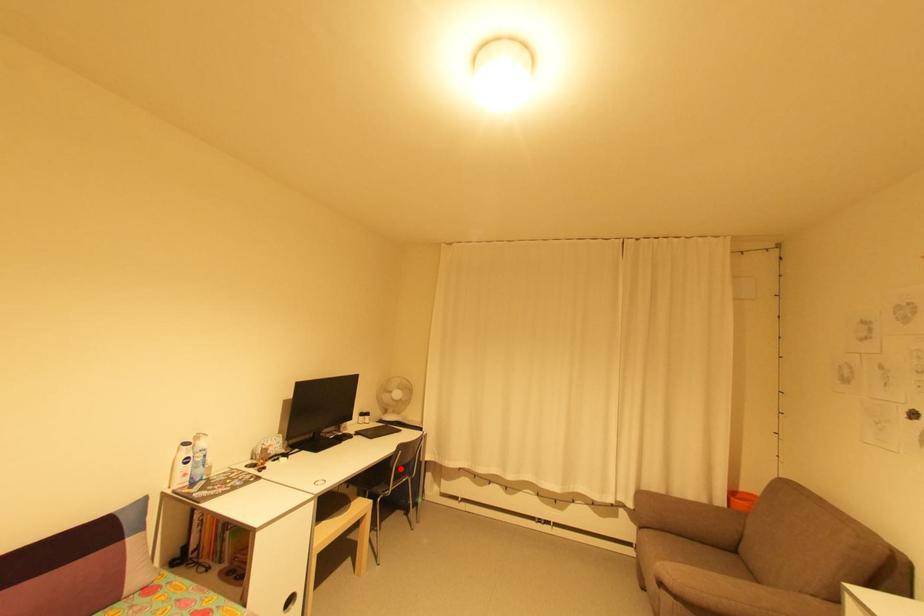
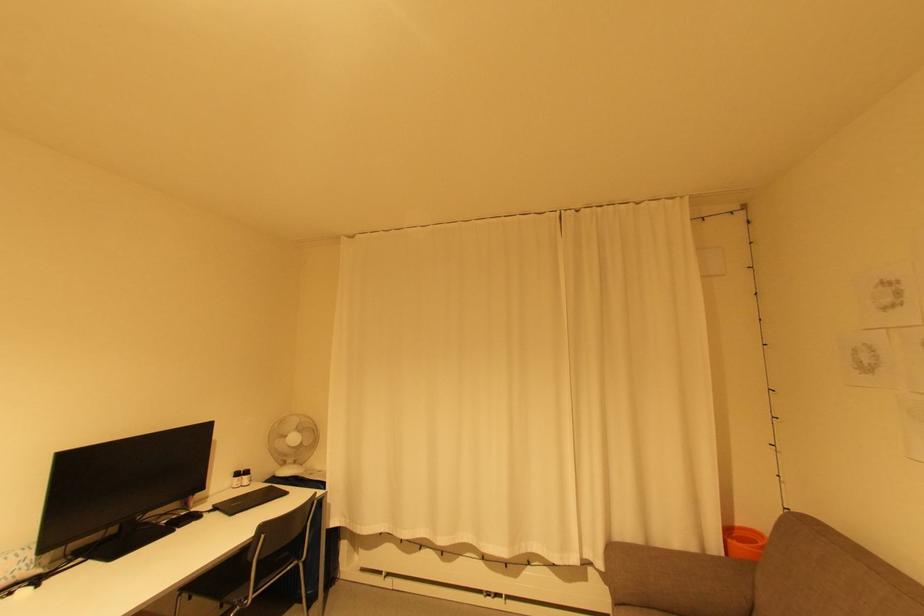
In the second image, find the point that corresponds to the highlighted location in the first image.

(262, 562)